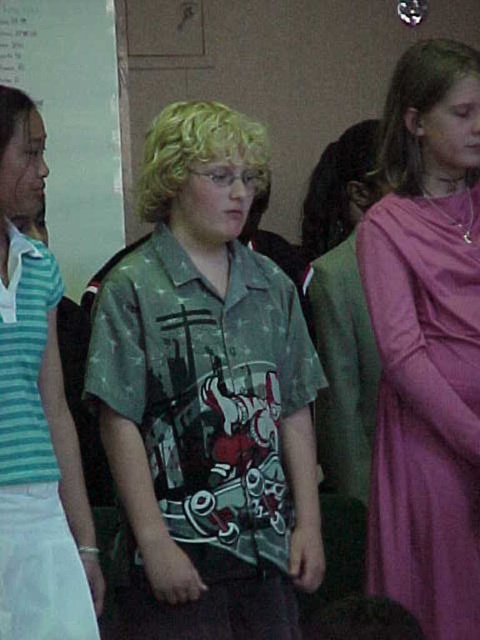
Is point (29, 161) positioned in front of point (402, 148)?

Yes, point (29, 161) is closer to viewer.

Image resolution: width=480 pixels, height=640 pixels. Describe the element at coordinates (37, 428) in the screenshot. I see `striped cotton shirt at left` at that location.

Locate an element on the screen. This screenshot has height=640, width=480. striped cotton shirt at left is located at coordinates (37, 428).

Between point (290, 394) and point (1, 148), which one is positioned behind?

Point (290, 394)

Does printed cotton shirt at center have a greater height compared to blonde hair at upper left?

Yes.

Does point (137, 456) come behind point (7, 134)?

Yes, point (137, 456) is farther from viewer.

Identify the location of printed cotton shirt at center. The image size is (480, 640). (207, 396).

Between purple satin dress at right and striped cotton shirt at left, which one is positioned lower?

Positioned lower is purple satin dress at right.

Does purple satin dress at right appear on the left side of striped cotton shirt at left?

No, purple satin dress at right is not to the left of striped cotton shirt at left.

What do you see at coordinates (425, 406) in the screenshot?
I see `purple satin dress at right` at bounding box center [425, 406].

The width and height of the screenshot is (480, 640). I want to click on purple satin dress at right, so click(425, 406).